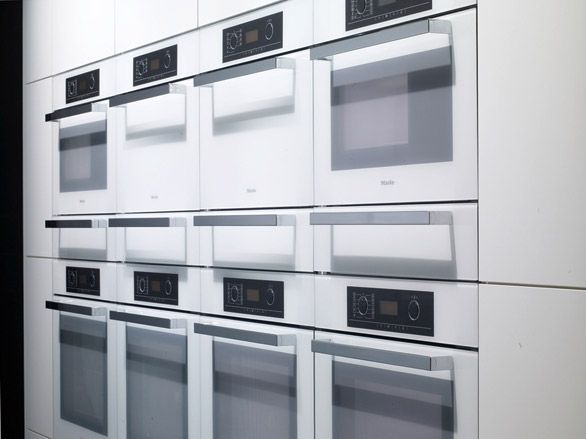
Locate an element on the screen. This screenshot has width=586, height=439. control panels is located at coordinates click(383, 306), click(264, 295), click(144, 284), click(79, 283), click(77, 86), click(149, 67), click(255, 37), click(360, 14).